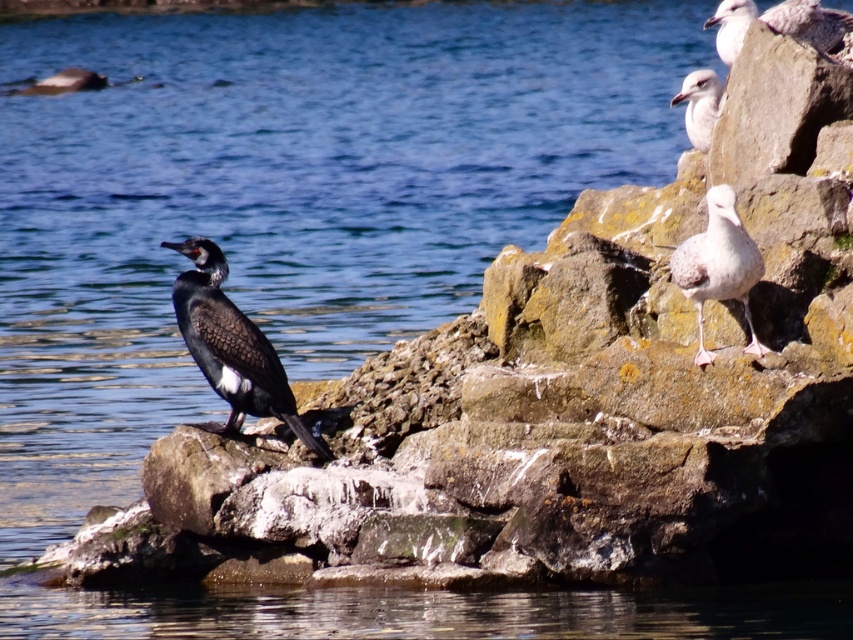
Question: Considering the real-world distances, which object is farthest from the white matte seagull at upper right?

Choices:
 (A) shiny black bird at center
 (B) white feathered bird at upper right
 (C) white glossy seagull at upper right

Answer: (A)

Question: Can you confirm if shiny black bird at center is positioned below white feathered bird at upper right?

Choices:
 (A) yes
 (B) no

Answer: (A)

Question: Can you confirm if shiny black bird at center is wider than white glossy seagull at upper right?

Choices:
 (A) yes
 (B) no

Answer: (B)

Question: Which of the following is the farthest from the observer?

Choices:
 (A) shiny black bird at center
 (B) white matte seagull at upper right
 (C) white feathered bird at upper right
 (D) white glossy seagull at upper right

Answer: (B)

Question: Which point is farther to the camera?

Choices:
 (A) (740, 8)
 (B) (744, 275)

Answer: (A)

Question: Does shiny black bird at center have a greater width compared to white matte seagull at upper right?

Choices:
 (A) no
 (B) yes

Answer: (A)